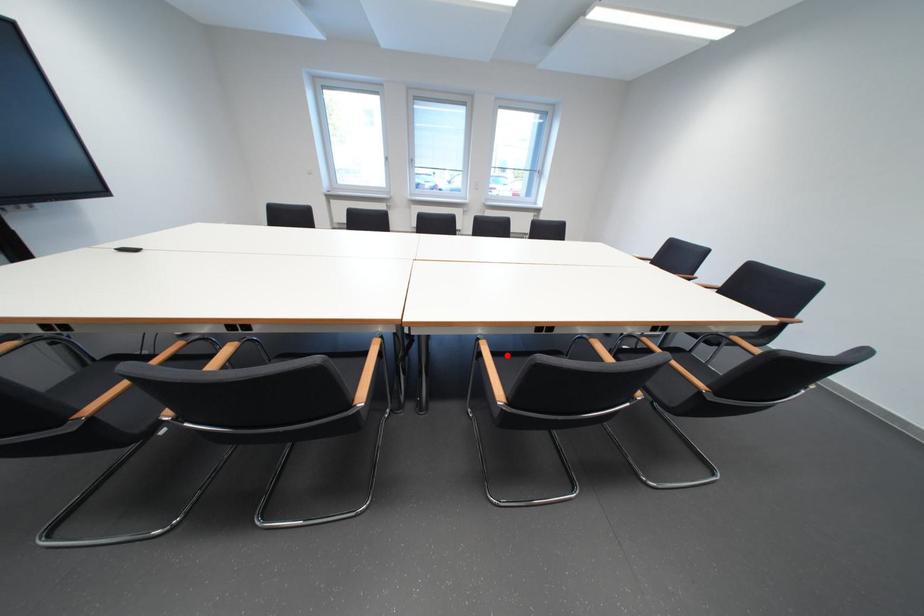
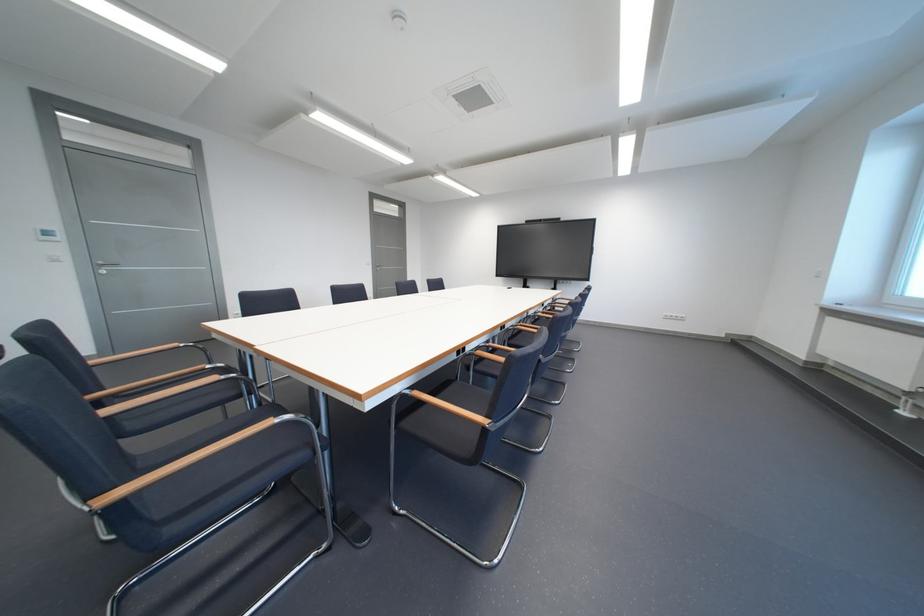
Question: I am providing you with two images of the same scene from different viewpoints. A red point is marked on the first image. Can you still see the location of the red point in image 2?

Choices:
 (A) Yes
 (B) No

Answer: (B)